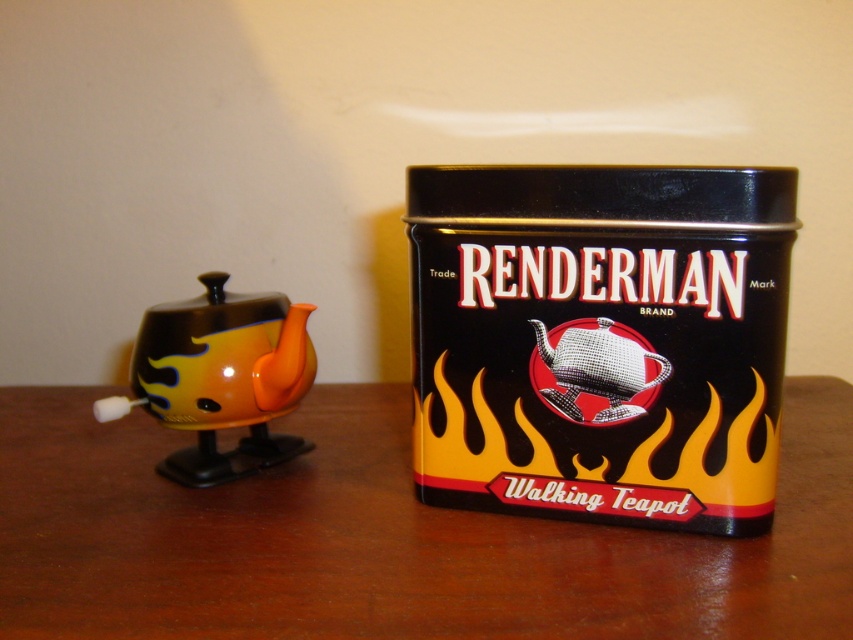
Question: In this image, where is orange glossy teapot at left located relative to shiny metallic teapot at center?

Choices:
 (A) below
 (B) above

Answer: (A)

Question: Which point appears closest to the camera in this image?

Choices:
 (A) (659, 374)
 (B) (422, 536)

Answer: (A)

Question: Which object appears farthest from the camera in this image?

Choices:
 (A) wooden table at center
 (B) orange glossy teapot at left

Answer: (B)

Question: Is wooden table at center bigger than shiny metallic teapot at center?

Choices:
 (A) no
 (B) yes

Answer: (B)

Question: Can you confirm if orange glossy teapot at left is smaller than shiny metallic teapot at center?

Choices:
 (A) no
 (B) yes

Answer: (A)

Question: Among these points, which one is nearest to the camera?

Choices:
 (A) (648, 380)
 (B) (198, 355)
 (C) (9, 476)

Answer: (A)